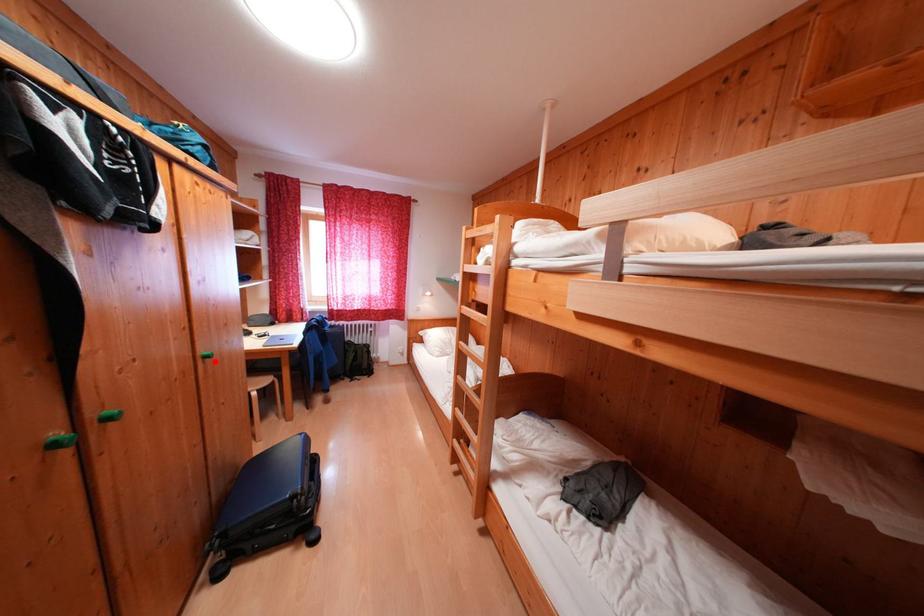
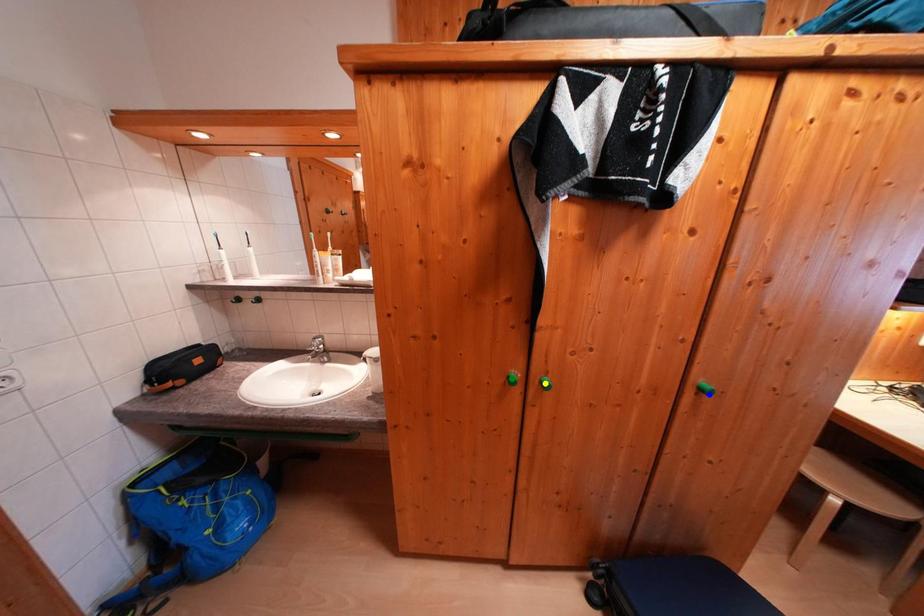
Question: I am providing you with two images of the same scene from different viewpoints. A red point is marked on the first image. You are given multiple points on the second image. Can you choose the point in image 2 that corresponds to the point in image 1?

Choices:
 (A) yellow point
 (B) green point
 (C) blue point

Answer: (C)